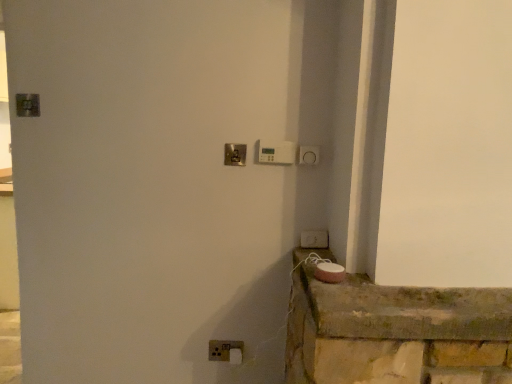
Question: Considering the relative sizes of polished brass door handle at center and white plastic light switch at lower right, which appears as the 3th light switch when viewed from the left, in the image provided, is polished brass door handle at center smaller than white plastic light switch at lower right, which appears as the 3th light switch when viewed from the left,?

Choices:
 (A) no
 (B) yes

Answer: (B)

Question: From a real-world perspective, is polished brass door handle at center physically below white plastic light switch at lower right, which appears as the 2th light switch when viewed from the top?

Choices:
 (A) no
 (B) yes

Answer: (A)

Question: Does polished brass door handle at center have a greater height compared to white plastic light switch at lower right, which appears as the 2th light switch when viewed from the top?

Choices:
 (A) yes
 (B) no

Answer: (A)

Question: Is polished brass door handle at center not near white plastic light switch at lower right, which appears as the 3th light switch when viewed from the left?

Choices:
 (A) yes
 (B) no

Answer: (B)

Question: Is polished brass door handle at center positioned beyond the bounds of white plastic light switch at lower right, which appears as the 3th light switch when viewed from the left?

Choices:
 (A) no
 (B) yes

Answer: (B)

Question: From the image's perspective, does polished brass door handle at center appear higher than white plastic light switch at lower right, which appears as the 2th light switch when viewed from the top?

Choices:
 (A) no
 (B) yes

Answer: (B)

Question: Can you confirm if white plastic light switch at lower center, placed as the first light switch when sorted from bottom to top, is bigger than polished brass door handle at center?

Choices:
 (A) yes
 (B) no

Answer: (A)

Question: Considering the relative sizes of white plastic light switch at lower center, placed as the first light switch when sorted from bottom to top, and polished brass door handle at center in the image provided, is white plastic light switch at lower center, placed as the first light switch when sorted from bottom to top, thinner than polished brass door handle at center?

Choices:
 (A) no
 (B) yes

Answer: (A)

Question: Would you say polished brass door handle at center is part of white plastic light switch at lower center, placed as the first light switch when sorted from bottom to top,'s contents?

Choices:
 (A) yes
 (B) no

Answer: (B)

Question: From the image's perspective, is white plastic light switch at lower center, placed as the first light switch when sorted from bottom to top, on polished brass door handle at center?

Choices:
 (A) no
 (B) yes

Answer: (A)

Question: From a real-world perspective, is white plastic light switch at lower center, the 3th light switch in the top-to-bottom sequence, located higher than polished brass door handle at center?

Choices:
 (A) yes
 (B) no

Answer: (B)

Question: Is white plastic light switch at lower center, the 3th light switch in the top-to-bottom sequence, wider than polished brass door handle at center?

Choices:
 (A) yes
 (B) no

Answer: (A)

Question: From a real-world perspective, is white plastic light switch at lower center, the 3th light switch in the top-to-bottom sequence, below white plastic light switch at lower right, which appears as the 2th light switch when viewed from the top?

Choices:
 (A) yes
 (B) no

Answer: (A)